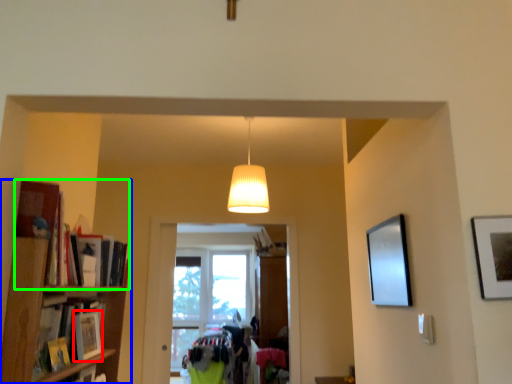
Question: Which object is the closest to the book (highlighted by a red box)? Choose among these: shelf (highlighted by a blue box) or book (highlighted by a green box).

Choices:
 (A) shelf
 (B) book

Answer: (A)